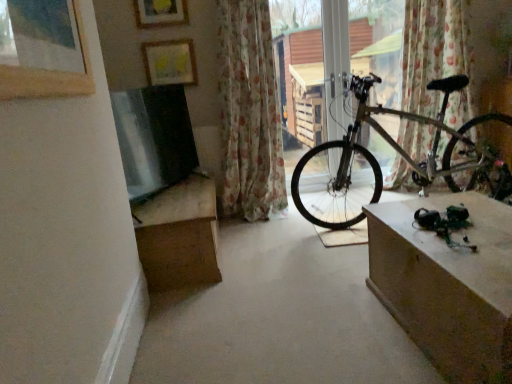
Locate an element on the screen. The height and width of the screenshot is (384, 512). free space above matte brown table at right (from a real-world perspective) is located at coordinates (476, 228).